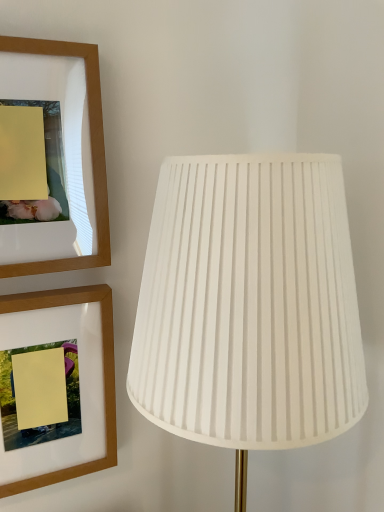
Question: From a real-world perspective, is wooden picture frame at upper left, the 2th picture frame positioned from the bottom, positioned above or below wooden picture frame at upper left, which is the second picture frame from top to bottom?

Choices:
 (A) above
 (B) below

Answer: (A)

Question: Visually, is wooden picture frame at upper left, positioned as the first picture frame in top-to-bottom order, positioned to the left or to the right of wooden picture frame at upper left, which is the first picture frame in bottom-to-top order?

Choices:
 (A) left
 (B) right

Answer: (A)

Question: Estimate the real-world distances between objects in this image. Which object is closer to the wooden picture frame at upper left, the 2th picture frame positioned from the bottom?

Choices:
 (A) wooden picture frame at upper left, which is the second picture frame from top to bottom
 (B) white pleated fabric lamp at right

Answer: (A)

Question: Based on their relative distances, which object is nearer to the wooden picture frame at upper left, positioned as the first picture frame in top-to-bottom order?

Choices:
 (A) wooden picture frame at upper left, which is the first picture frame in bottom-to-top order
 (B) white pleated fabric lamp at right

Answer: (A)